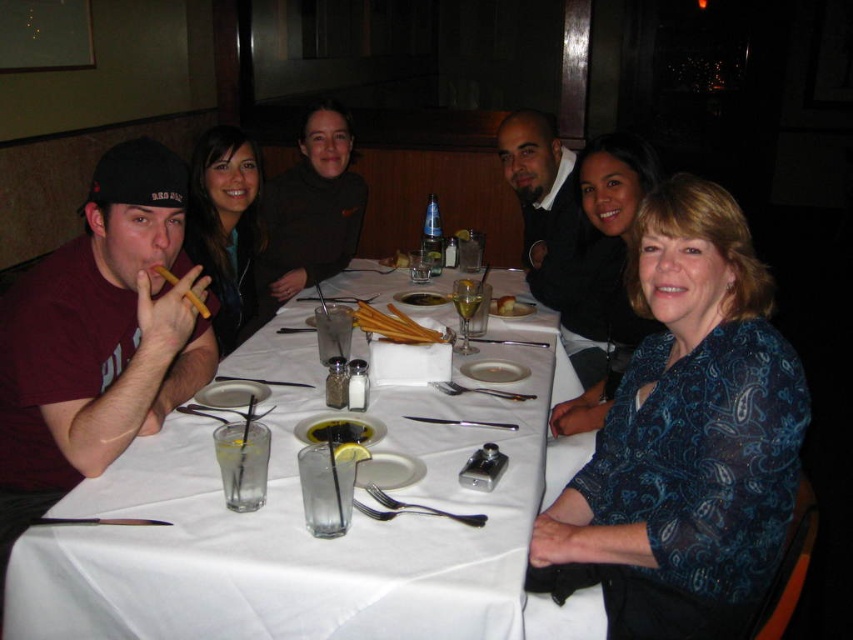
Consider the image. You are a photographer trying to capture a closeup of the two points marked in the image. Which of the two points, point (x=395, y=332) or point (x=498, y=300), is closer to the camera?

Point (x=395, y=332) is closer to the camera than point (x=498, y=300).

In the scene shown: You are a photographer taking a picture of the matte black jacket at upper left and the smooth brown breadsticks at center. Which object should you focus on first if you want to capture both in one frame without moving the camera?

The matte black jacket at upper left should be focused on first because it is larger in size compared to the smooth brown breadsticks at center, ensuring it is clearly visible in the frame.